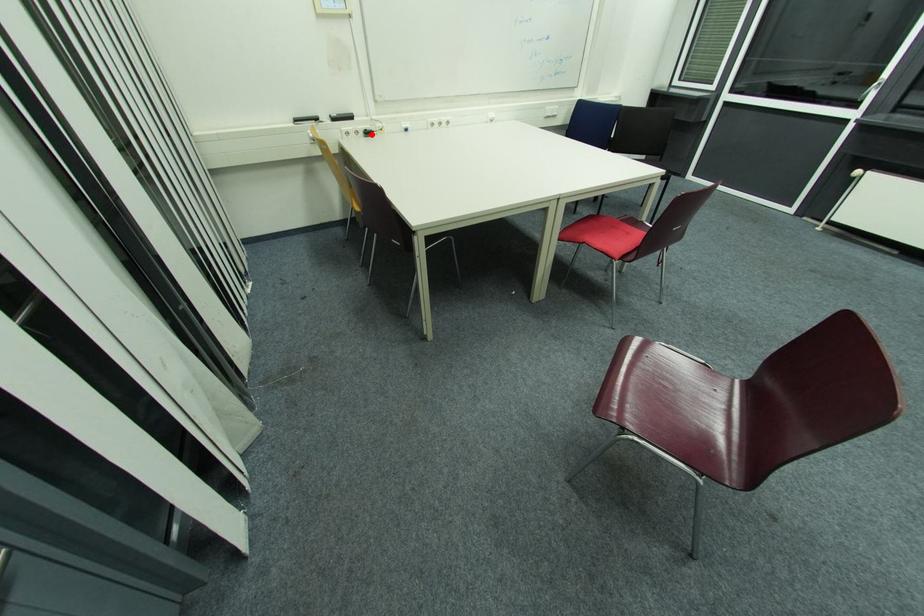
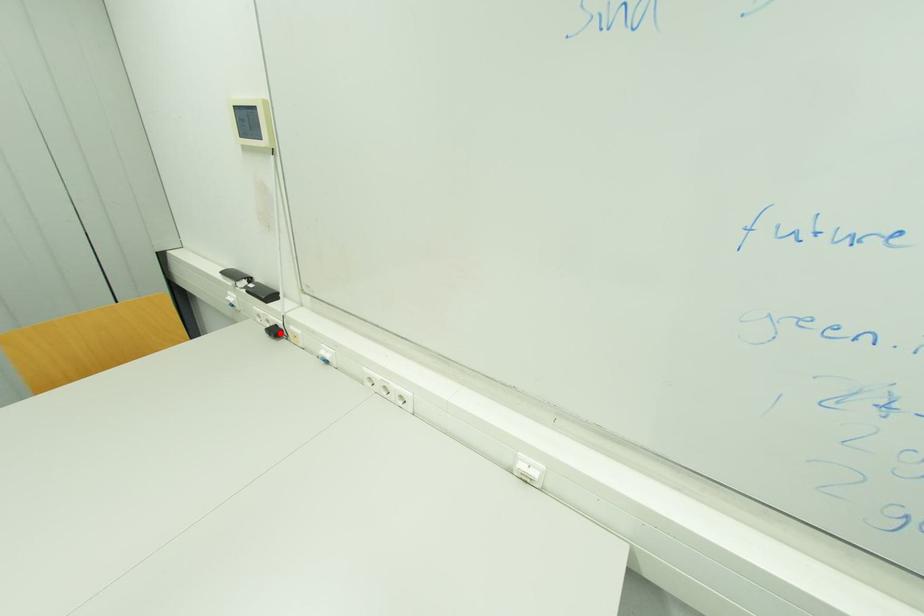
I am providing you with two images of the same scene from different viewpoints. A red point is marked on the first image and another point is marked on the second image. Is the red point in image1 aligned with the point shown in image2?

Yes